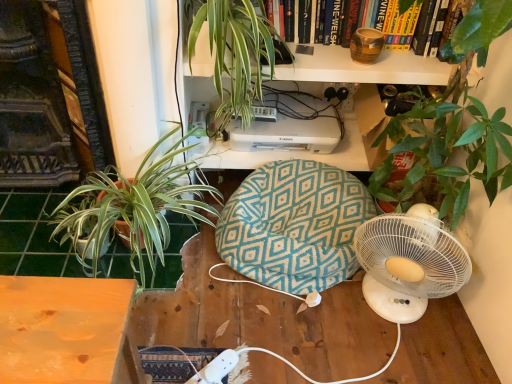
Question: Considering the relative positions of teal fabric bean bag at center and green leafy plant at upper center, arranged as the 2th houseplant when ordered from the bottom, in the image provided, is teal fabric bean bag at center behind green leafy plant at upper center, arranged as the 2th houseplant when ordered from the bottom,?

Choices:
 (A) no
 (B) yes

Answer: (B)

Question: Is the surface of teal fabric bean bag at center in direct contact with green leafy plant at upper center, which is counted as the first houseplant, starting from the top?

Choices:
 (A) yes
 (B) no

Answer: (B)

Question: Does teal fabric bean bag at center have a lesser height compared to green leafy plant at upper center, arranged as the 2th houseplant when ordered from the bottom?

Choices:
 (A) no
 (B) yes

Answer: (B)

Question: Is teal fabric bean bag at center outside green leafy plant at upper center, which is counted as the first houseplant, starting from the top?

Choices:
 (A) yes
 (B) no

Answer: (A)

Question: From a real-world perspective, does teal fabric bean bag at center sit lower than green leafy plant at upper center, which is counted as the first houseplant, starting from the top?

Choices:
 (A) no
 (B) yes

Answer: (B)

Question: Does point (384, 38) appear closer or farther from the camera than point (96, 177)?

Choices:
 (A) closer
 (B) farther

Answer: (A)

Question: Is brown textured vase at upper center inside or outside of green leafy plant at left, the 1th houseplant from the bottom?

Choices:
 (A) outside
 (B) inside

Answer: (A)

Question: From a real-world perspective, is brown textured vase at upper center physically located above or below green leafy plant at left, the 1th houseplant from the bottom?

Choices:
 (A) below
 (B) above

Answer: (B)

Question: Is brown textured vase at upper center wider or thinner than green leafy plant at left, arranged as the 2th houseplant when viewed from the top?

Choices:
 (A) wide
 (B) thin

Answer: (B)

Question: From the image's perspective, relative to green leafy plant at upper center, arranged as the 2th houseplant when ordered from the bottom, is white plastic printer at upper center above or below?

Choices:
 (A) above
 (B) below

Answer: (B)

Question: From a real-world perspective, is white plastic printer at upper center physically located above or below green leafy plant at upper center, which is counted as the first houseplant, starting from the top?

Choices:
 (A) above
 (B) below

Answer: (B)

Question: Do you think white plastic printer at upper center is within green leafy plant at upper center, arranged as the 2th houseplant when ordered from the bottom, or outside of it?

Choices:
 (A) outside
 (B) inside

Answer: (A)

Question: Considering the positions of point (320, 150) and point (258, 36), is point (320, 150) closer or farther from the camera than point (258, 36)?

Choices:
 (A) closer
 (B) farther

Answer: (B)

Question: Is teal fabric bean bag at center taller or shorter than brown textured vase at upper center?

Choices:
 (A) short
 (B) tall

Answer: (B)

Question: Based on their sizes in the image, would you say teal fabric bean bag at center is bigger or smaller than brown textured vase at upper center?

Choices:
 (A) big
 (B) small

Answer: (A)